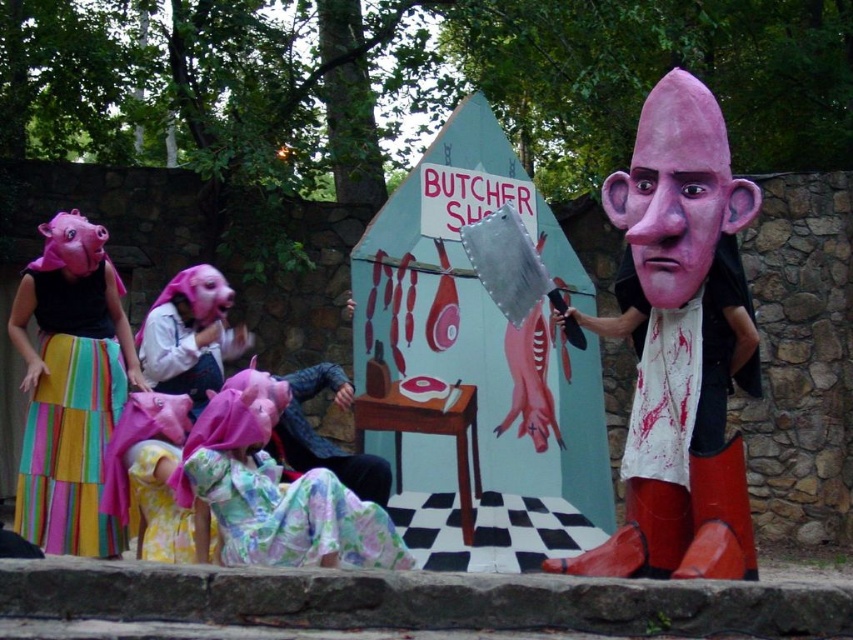
Question: Which of the following is the closest to the observer?

Choices:
 (A) matte pink head at right
 (B) smooth plastic head at center right
 (C) floral fabric dress at center
 (D) multicolored fabric skirt at left

Answer: (C)

Question: Where is floral fabric dress at center located in relation to smooth plastic head at center right in the image?

Choices:
 (A) left
 (B) right

Answer: (A)

Question: Where is multicolored fabric skirt at left located in relation to floral fabric dress at center in the image?

Choices:
 (A) left
 (B) right

Answer: (A)

Question: Which object is the closest to the floral fabric dress at center?

Choices:
 (A) matte pink head at right
 (B) smooth plastic head at center right
 (C) multicolored fabric skirt at left

Answer: (C)

Question: Does matte pink head at right have a greater width compared to multicolored fabric skirt at left?

Choices:
 (A) no
 (B) yes

Answer: (B)

Question: Which object appears closest to the camera in this image?

Choices:
 (A) floral fabric dress at center
 (B) multicolored fabric skirt at left
 (C) matte pink head at right
 (D) smooth plastic head at center right

Answer: (A)